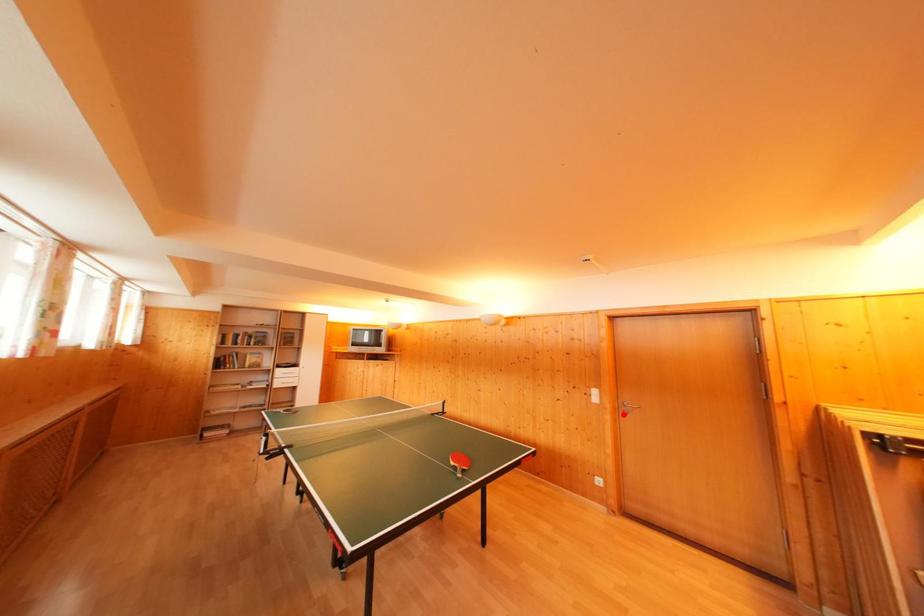
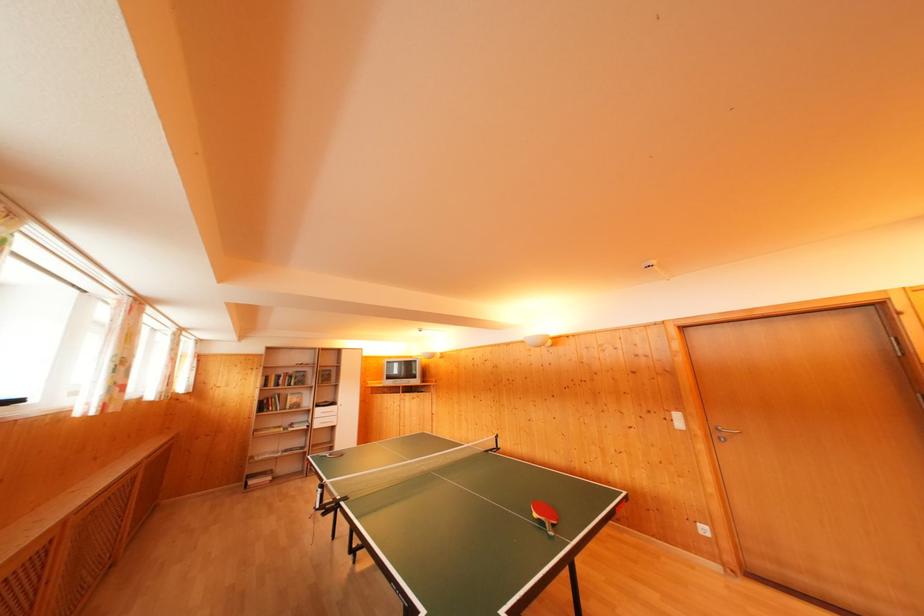
In the second image, find the point that corresponds to the highlighted location in the first image.

(718, 440)